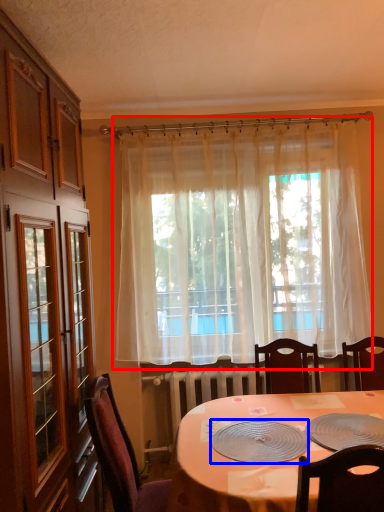
Question: Which point is further to the camera, curtain (highlighted by a red box) or platter (highlighted by a blue box)?

Choices:
 (A) curtain
 (B) platter

Answer: (A)